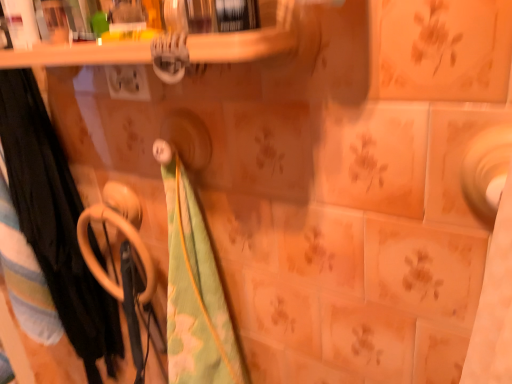
Question: Is black fabric towel at left, which is the 3th beach towel from right to left, bigger or smaller than green floral fabric at center, arranged as the third beach towel when viewed from the left?

Choices:
 (A) small
 (B) big

Answer: (B)

Question: From a real-world perspective, relative to green floral fabric at center, which is the 1th beach towel from right to left, is black fabric towel at left, the first beach towel from the left, vertically above or below?

Choices:
 (A) below
 (B) above

Answer: (A)

Question: Which object is the closest to the green cotton beach towel at left, which is counted as the second beach towel, starting from the left?

Choices:
 (A) green floral fabric at center, arranged as the third beach towel when viewed from the left
 (B) black fabric towel at left, the first beach towel from the left
 (C) matte ceramic tile at right
 (D) beige plastic towel rack at lower left

Answer: (B)

Question: Which object is the closest to the beige plastic towel rack at lower left?

Choices:
 (A) green floral fabric at center, which is the 1th beach towel from right to left
 (B) black fabric towel at left, which is the 3th beach towel from right to left
 (C) matte ceramic tile at right
 (D) green cotton beach towel at left, which is counted as the second beach towel, starting from the left

Answer: (D)